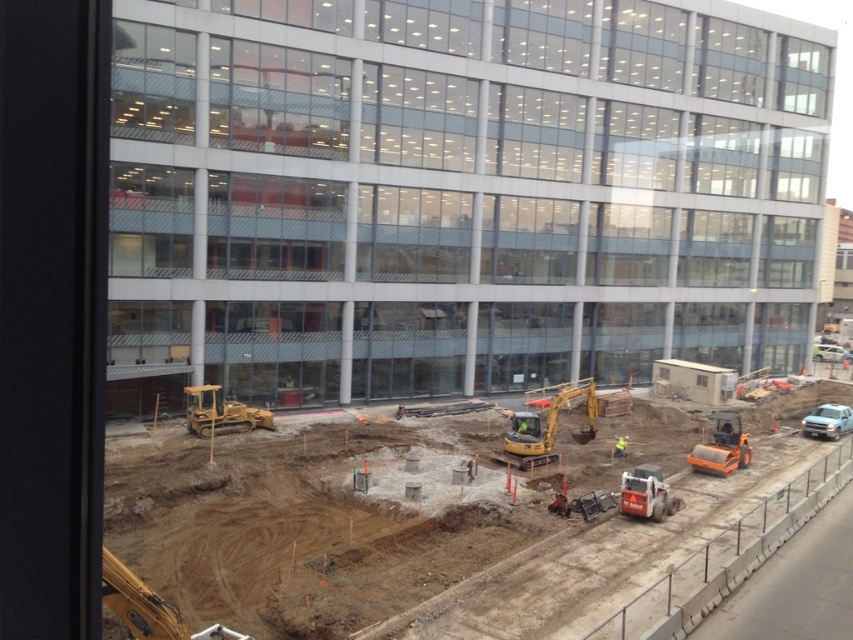
Between brown dirt at lower center and orange rubber roller at lower right, which one is positioned lower?

brown dirt at lower center is below.

Based on the photo, is brown dirt at lower center below orange rubber roller at lower right?

Yes, brown dirt at lower center is below orange rubber roller at lower right.

This screenshot has width=853, height=640. Describe the element at coordinates (415, 540) in the screenshot. I see `brown dirt at lower center` at that location.

At what (x,y) coordinates should I click in order to perform the action: click on brown dirt at lower center. Please return your answer as a coordinate pair (x, y). This screenshot has height=640, width=853. Looking at the image, I should click on (415, 540).

Between yellow rubber bulldozer at lower center and orange rubber roller at lower right, which one appears on the left side from the viewer's perspective?

yellow rubber bulldozer at lower center is more to the left.

Locate an element on the screen. The height and width of the screenshot is (640, 853). yellow rubber bulldozer at lower center is located at coordinates (221, 412).

This screenshot has width=853, height=640. I want to click on yellow rubber bulldozer at lower center, so click(x=221, y=412).

Is point (216, 385) more distant than point (834, 440)?

No, (216, 385) is closer to viewer.

Who is shorter, yellow rubber bulldozer at lower center or silver metallic truck at lower right?

silver metallic truck at lower right is shorter.

Is point (227, 419) positioned in front of point (805, 432)?

That is True.

The image size is (853, 640). Identify the location of yellow rubber bulldozer at lower center. (221, 412).